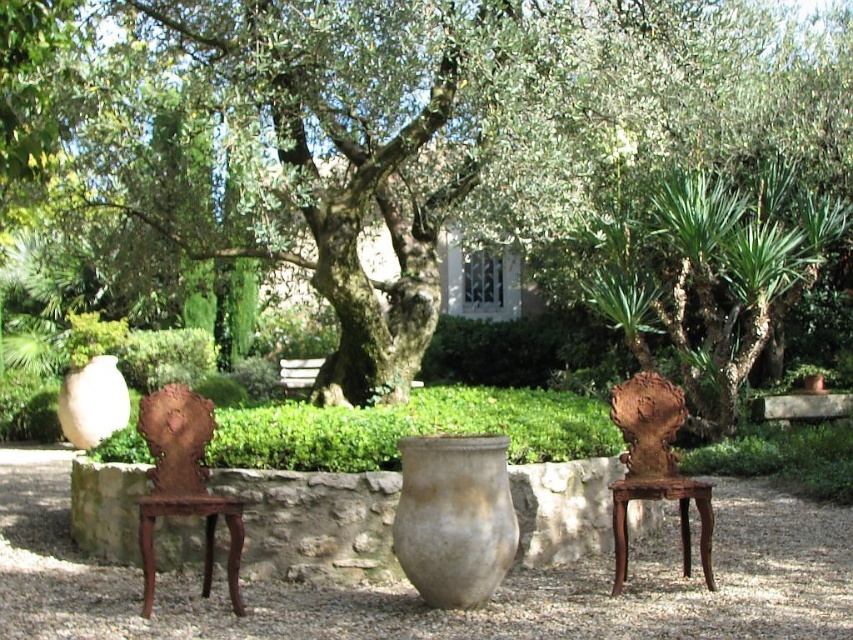
Can you confirm if rusty metal sculpture at right is smaller than rustic wood table at center?

Yes, rusty metal sculpture at right is smaller than rustic wood table at center.

Locate an element on the screen. This screenshot has width=853, height=640. rusty metal sculpture at right is located at coordinates (647, 422).

Which is more to the right, green leafy tree at center or rustic wood table at center?

rustic wood table at center is more to the right.

Does green leafy tree at center appear on the right side of rustic wood table at center?

Incorrect, green leafy tree at center is not on the right side of rustic wood table at center.

You are a GUI agent. You are given a task and a screenshot of the screen. Output one action in this format:
    pyautogui.click(x=<x>, y=<y>)
    Task: Click on the green leafy tree at center
    The width and height of the screenshot is (853, 640).
    Given the screenshot: What is the action you would take?
    pyautogui.click(x=402, y=132)

Which of these two, matte gray vase at center or matte white vase at left, stands taller?

With more height is matte white vase at left.

Between point (457, 451) and point (96, 429), which one is positioned behind?

The point (96, 429) is more distant.

Between point (469, 509) and point (67, 396), which one is positioned in front?

Point (469, 509)

Find the location of a particular element. matte gray vase at center is located at coordinates (454, 516).